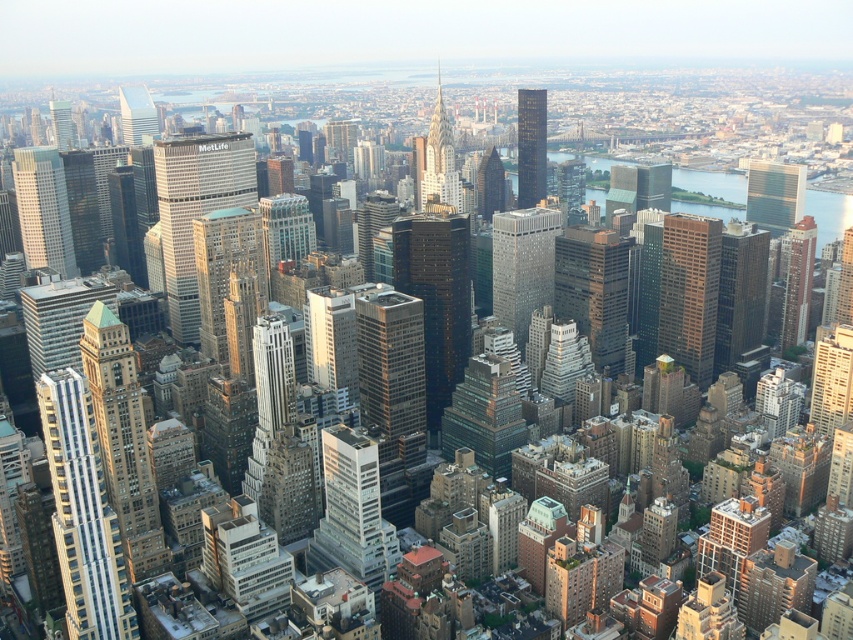
Question: Can you confirm if white glass skyscraper at left is smaller than matte glass skyscraper at upper left?

Choices:
 (A) yes
 (B) no

Answer: (B)

Question: Estimate the real-world distances between objects in this image. Which object is closer to the silver glass skyscraper at center?

Choices:
 (A) shiny glass skyscraper at center
 (B) gold reflective skyscraper at center

Answer: (A)

Question: Is green glass skyscraper at center above shiny glass skyscraper at center?

Choices:
 (A) no
 (B) yes

Answer: (A)

Question: Does silver glass skyscraper at center have a greater width compared to green glass skyscraper at center?

Choices:
 (A) yes
 (B) no

Answer: (A)

Question: Which point is closer to the camera taking this photo?

Choices:
 (A) (527, 278)
 (B) (50, 209)

Answer: (A)

Question: Which point is closer to the camera?

Choices:
 (A) (560, 218)
 (B) (374, 417)
 (C) (425, 157)

Answer: (B)